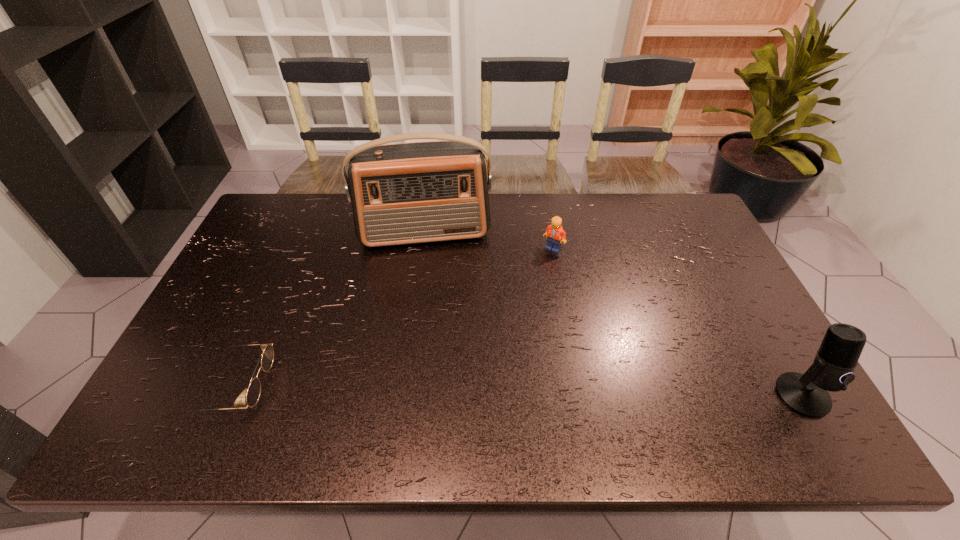
I want to click on object that is at the near left corner, so click(253, 393).

Where is `object that is positioned at the near right corner`? object that is positioned at the near right corner is located at coordinates (832, 370).

The height and width of the screenshot is (540, 960). I want to click on free spot at the far edge of the desktop, so click(318, 201).

This screenshot has height=540, width=960. Identify the location of vacant space at the near edge of the desktop. (491, 404).

This screenshot has width=960, height=540. I want to click on vacant region at the left edge of the desktop, so click(x=256, y=247).

In the image, there is a desktop. Identify the location of vacant space at the right edge. click(721, 280).

You are a GUI agent. You are given a task and a screenshot of the screen. Output one action in this format:
    pyautogui.click(x=<x>, y=<y>)
    Task: Click on the free space at the far left corner
    
    Given the screenshot: What is the action you would take?
    pyautogui.click(x=279, y=208)

At what (x,y) coordinates should I click in order to perform the action: click on vacant space at the near right corner of the desktop. Please return your answer as a coordinate pair (x, y). This screenshot has width=960, height=540. Looking at the image, I should click on (731, 387).

You are a GUI agent. You are given a task and a screenshot of the screen. Output one action in this format:
    pyautogui.click(x=<x>, y=<y>)
    Task: Click on the free area in between the rightmost object and the leftmost object
    This screenshot has height=540, width=960.
    Given the screenshot: What is the action you would take?
    pyautogui.click(x=519, y=391)

The image size is (960, 540). In order to click on vacant region between the rightmost object and the sunglasses in this screenshot , I will do `click(519, 391)`.